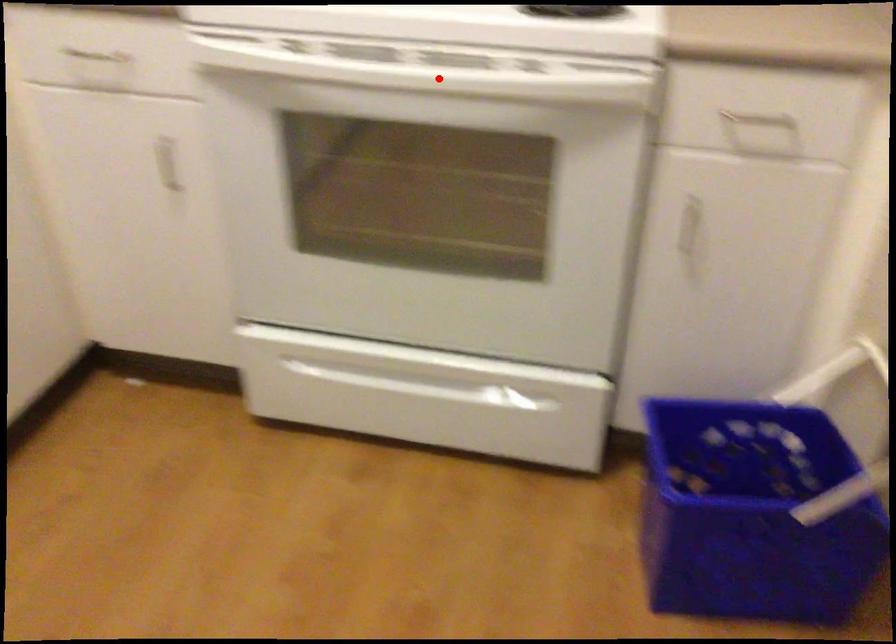
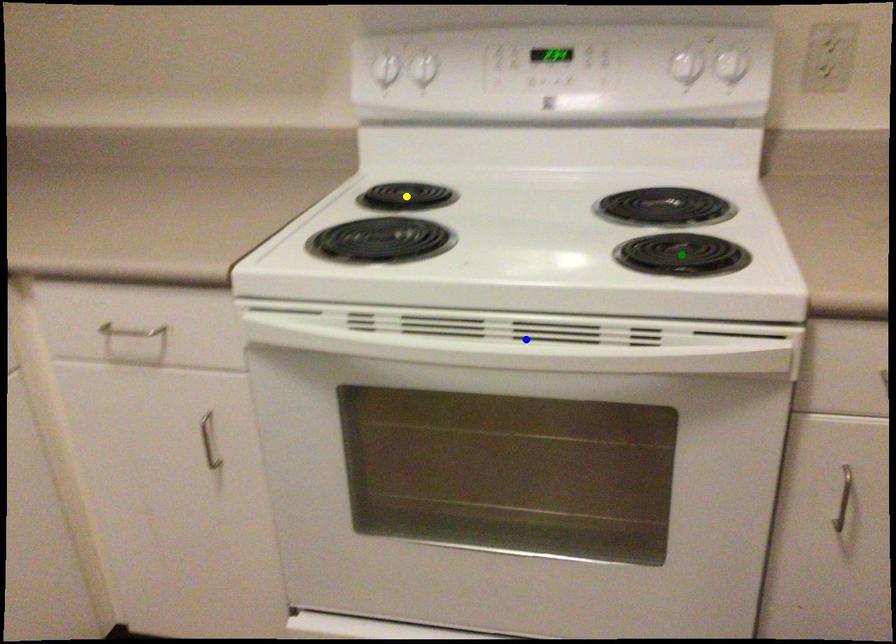
Question: I am providing you with two images of the same scene from different viewpoints. A red point is marked on the first image. You are given multiple points on the second image. Which point in image 2 is actually the same real-world point as the red point in image 1?

Choices:
 (A) blue point
 (B) green point
 (C) yellow point

Answer: (A)